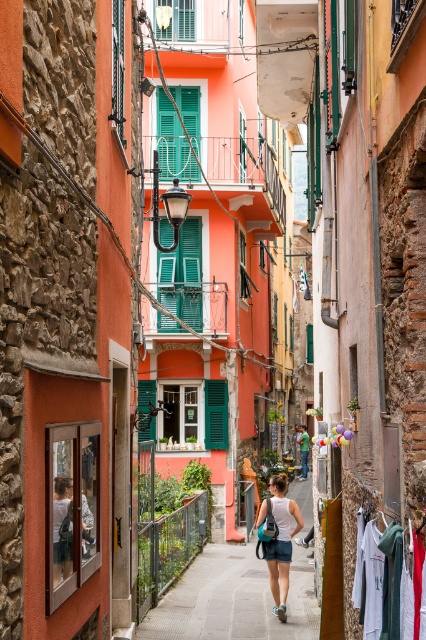
Question: Which point is farther to the camera?

Choices:
 (A) (374, 636)
 (B) (192, 122)

Answer: (B)

Question: In this image, where is green matte shutter at center located relative to white fabric at center?

Choices:
 (A) below
 (B) above

Answer: (B)

Question: Which point is farther from the camera taking this photo?

Choices:
 (A) (161, 268)
 (B) (302, 595)
 (C) (271, 570)
 (D) (304, 461)

Answer: (D)

Question: From the image, what is the correct spatial relationship of white fabric skirt at center in relation to white fabric at center?

Choices:
 (A) below
 (B) above

Answer: (B)

Question: Which point is closer to the camera?

Choices:
 (A) white fabric skirt at center
 (B) green painted wood shutter at center
 (C) green matte shutter at upper center

Answer: (A)

Question: Observing the image, what is the correct spatial positioning of white cotton shirt at lower right in reference to green painted wood shutter at center?

Choices:
 (A) left
 (B) right

Answer: (B)